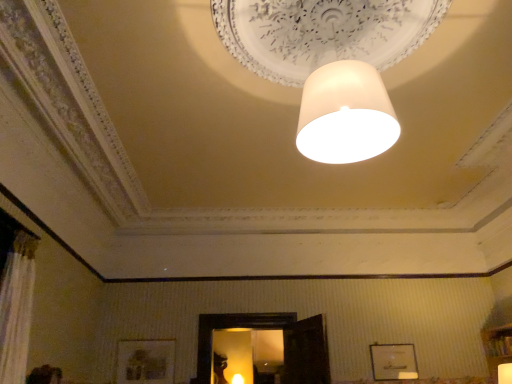
Question: From the image's perspective, would you say white matte lampshade at center, the 1th lamp when ordered from top to bottom, is shown under matte white lampshade at upper center, arranged as the second lamp when ordered from the bottom?

Choices:
 (A) no
 (B) yes

Answer: (A)

Question: Is white matte lampshade at center, arranged as the third lamp when ordered from the bottom, completely or partially outside of matte white lampshade at upper center, which ranks as the third lamp in left-to-right order?

Choices:
 (A) yes
 (B) no

Answer: (A)

Question: Is white matte lampshade at center, the 1th lamp when ordered from front to back, looking in the opposite direction of matte white lampshade at upper center, which ranks as the third lamp in left-to-right order?

Choices:
 (A) no
 (B) yes

Answer: (A)

Question: Is matte white lampshade at upper center, which is counted as the second lamp, starting from the top, inside white matte lampshade at center, arranged as the second lamp when viewed from the right?

Choices:
 (A) yes
 (B) no

Answer: (B)

Question: Is white matte lampshade at center, arranged as the third lamp when ordered from the bottom, not near matte white lampshade at upper center, which ranks as the third lamp in left-to-right order?

Choices:
 (A) yes
 (B) no

Answer: (A)

Question: Relative to matte white lampshade at upper center, marked as the 1th lamp in a bottom-to-top arrangement, is white matte lampshade at center, arranged as the second lamp when viewed from the right, in front or behind?

Choices:
 (A) behind
 (B) front

Answer: (B)

Question: Is point (286, 3) closer or farther from the camera than point (242, 375)?

Choices:
 (A) closer
 (B) farther

Answer: (A)

Question: Is white matte lampshade at center, which is counted as the second lamp, starting from the left, to the left or to the right of matte white lampshade at upper center, which ranks as the first lamp in back-to-front order, in the image?

Choices:
 (A) left
 (B) right

Answer: (B)

Question: Choose the correct answer: Is white matte lampshade at center, which is counted as the third lamp, starting from the back, inside matte white lampshade at upper center, marked as the 1th lamp in a bottom-to-top arrangement, or outside it?

Choices:
 (A) outside
 (B) inside

Answer: (A)

Question: Looking at their shapes, would you say white matte lampshade at center, the 1th lamp when ordered from top to bottom, is wider or thinner than wooden picture frame at lower center, placed as the second picture frame when sorted from right to left?

Choices:
 (A) wide
 (B) thin

Answer: (A)

Question: In terms of size, does white matte lampshade at center, the 1th lamp when ordered from front to back, appear bigger or smaller than wooden picture frame at lower center, the 1th picture frame positioned from the left?

Choices:
 (A) big
 (B) small

Answer: (A)

Question: Based on their positions, is white matte lampshade at center, arranged as the second lamp when viewed from the right, located to the left or right of wooden picture frame at lower center, the 1th picture frame positioned from the left?

Choices:
 (A) right
 (B) left

Answer: (A)

Question: From the image's perspective, is white matte lampshade at center, the 1th lamp when ordered from front to back, above or below wooden picture frame at lower center, the 1th picture frame positioned from the left?

Choices:
 (A) above
 (B) below

Answer: (A)

Question: Would you say matte white lampshade at upper center, marked as the 1th lamp in a bottom-to-top arrangement, is to the left or to the right of wooden picture frame at lower center, placed as the second picture frame when sorted from right to left, in the picture?

Choices:
 (A) right
 (B) left

Answer: (A)

Question: In terms of size, does matte white lampshade at upper center, which is the third lamp from right to left, appear bigger or smaller than wooden picture frame at lower center, the 1th picture frame positioned from the left?

Choices:
 (A) big
 (B) small

Answer: (B)